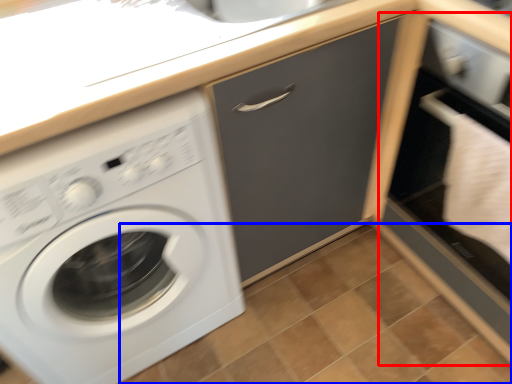
Question: Which object is closer to the camera taking this photo, file cabinet (highlighted by a red box) or tile (highlighted by a blue box)?

Choices:
 (A) file cabinet
 (B) tile

Answer: (A)